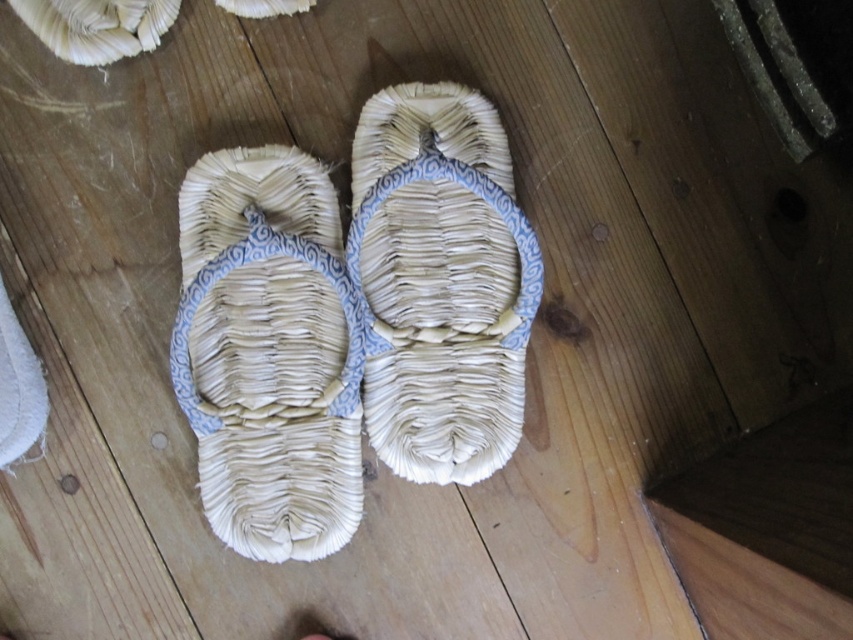
You are standing in a room with two sandals, the woven straw sandal at center and the natural fiber sandal at center. Which sandal is positioned lower on the floor?

The woven straw sandal at center is positioned lower on the floor because it is below the natural fiber sandal at center.

You are a shoemaker trying to place a new sandal between the two sandals shown in the image. The new sandal is 3 inches wide. Can you fit it between the woven straw sandal at center and the natural fiber sandal at center?

The distance between the woven straw sandal at center and the natural fiber sandal at center is 5.24 inches, which is wider than the 3 inch width of the new sandal. Therefore, the new sandal can fit between them.

Based on the photo, you are standing in a room with a wooden floor and see two points marked on the floor. You want to place a small decorative item at the point that is closer to you. Which point should you choose between point (256, 410) and point (453, 435)?

Point (256, 410) is in front of point (453, 435), so you should choose point (256, 410) since it is closer to you.